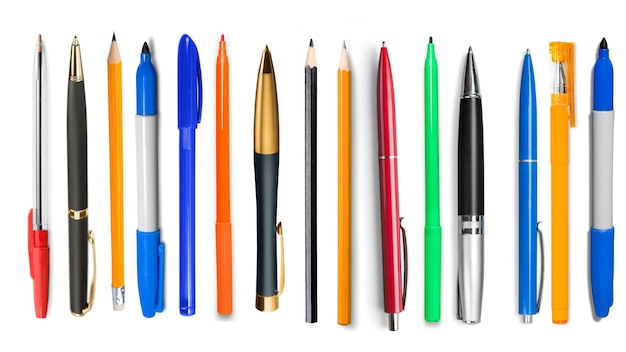
Find the location of a particular element. This screenshot has width=626, height=352. markers is located at coordinates (603, 270), (441, 254), (223, 248), (143, 242).